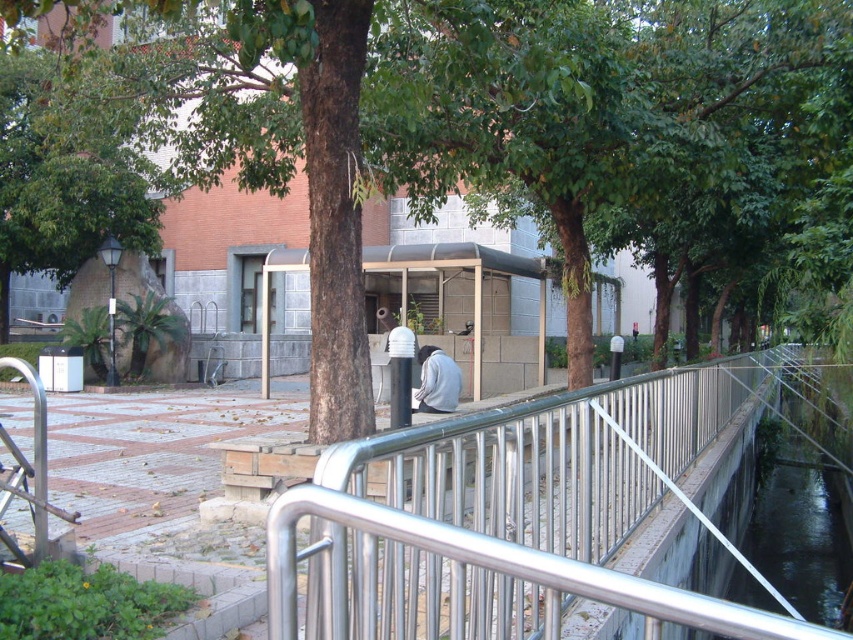
You are standing in the urban outdoor area and want to take a photo of the brown textured tree at center. If your camera can focus on objects up to 5 meters away, will you be able to capture a clear photo of the tree?

The brown textured tree at center is 4.54 meters away from the viewer. Since the camera can focus up to 5 meters, you can capture a clear photo of the brown textured tree at center as it is within the camera range.

You are standing at the entrance of the urban area shown in the image. You need to locate the silver metallic railing at center. Based on its 2D coordinates, which direction should you face to see it directly?

The silver metallic railing at center is located at coordinates 0.809 on the x axis and 0.598 on the y axis. Since the x coordinate is closer to 1, it means it is positioned more to the right side of the image. The y coordinate being closer to 0.6 places it towards the center vertically. Therefore, you should face towards the right to directly see the silver metallic railing at center.

You are standing at the edge of the water channel and want to cross to the other side. The silver metallic railing at center and the clear glass waterway at center are in your path. Which object should you avoid stepping on to stay safe?

You should avoid stepping on the clear glass waterway at center because it is a waterway and the silver metallic railing at center is a railing above it, so the glass waterway might be slippery or unstable.